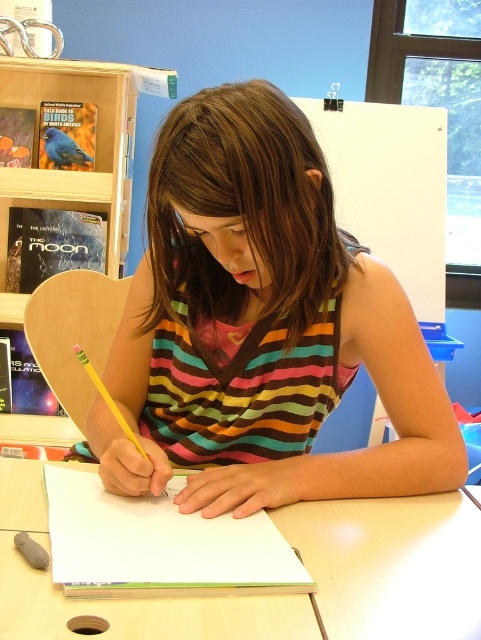
What are the coordinates of the striped fabric shirt at center?

The striped fabric shirt at center is located at coordinates point (261,326).

You are a photographer setting up a shot of the striped fabric shirt at center and the wooden bookshelf at upper left. Which object will appear closer to the camera in the final photo?

The striped fabric shirt at center will appear closer to the camera in the final photo because it is in front of the wooden bookshelf at upper left.